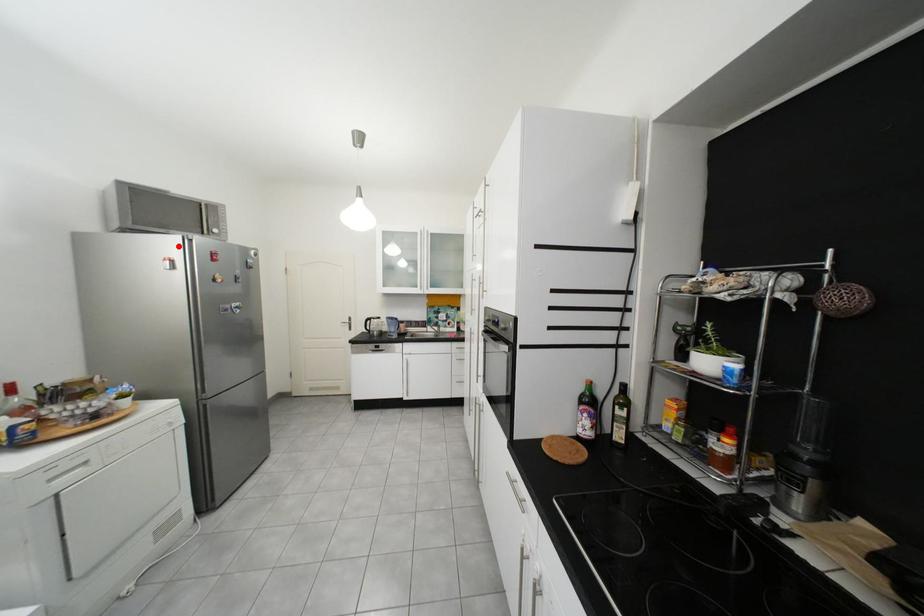
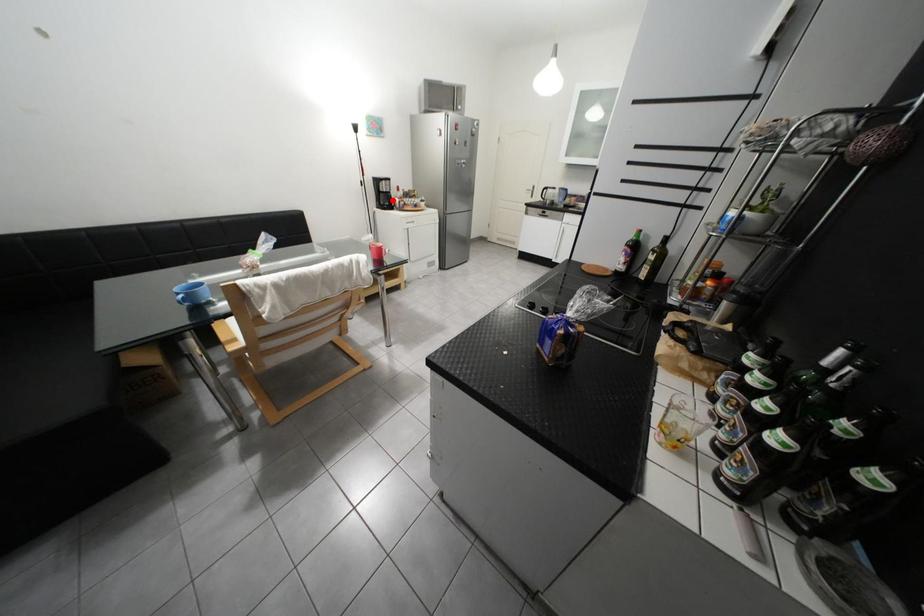
Consider the image. I am providing you with two images of the same scene from different viewpoints. A red point is marked on the first image and another point is marked on the second image. Are the points marked in image1 and image2 representing the same 3D position?

No